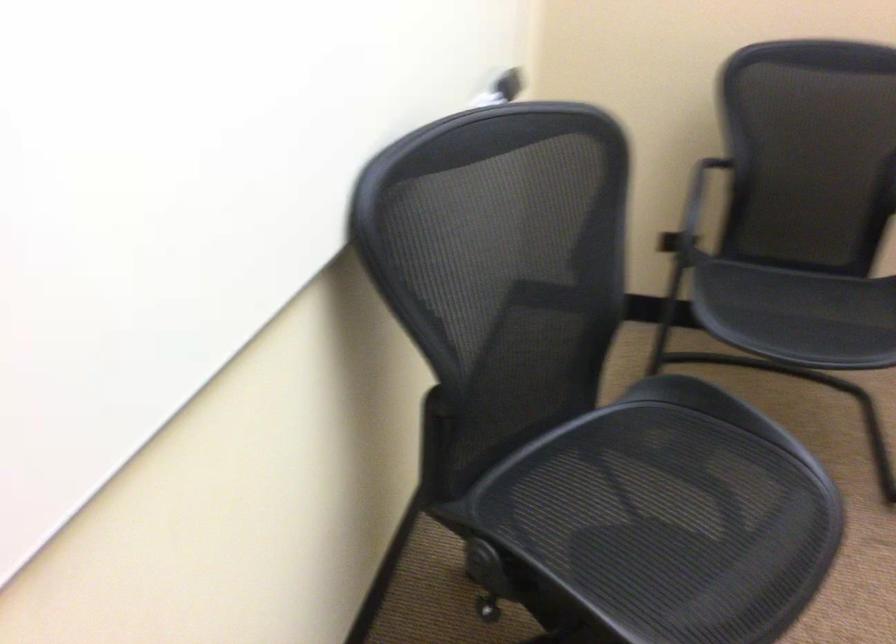
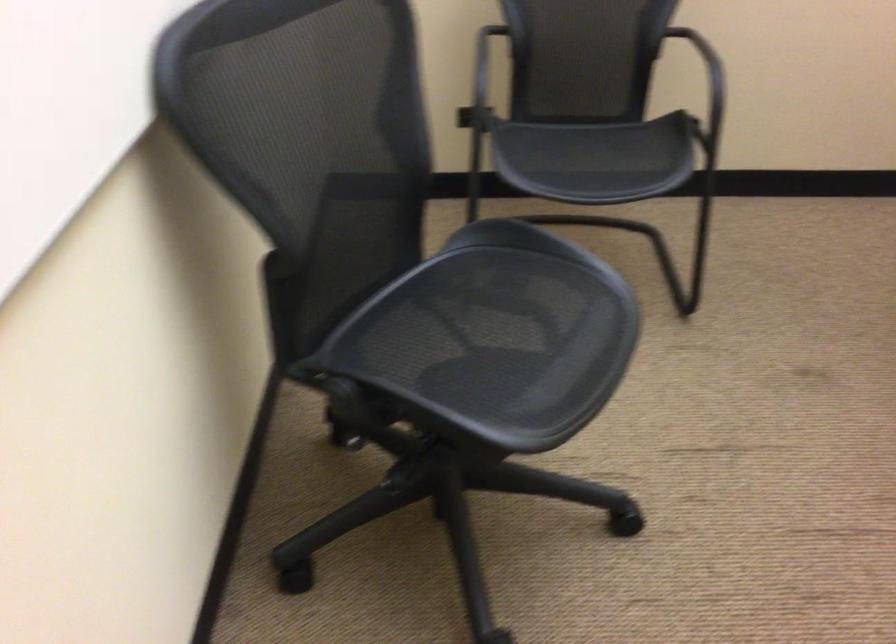
Question: Which direction would the cameraman need to move to produce the second image? Reply with the corresponding letter.

Choices:
 (A) Left
 (B) Right
 (C) Forward
 (D) Backward

Answer: (D)